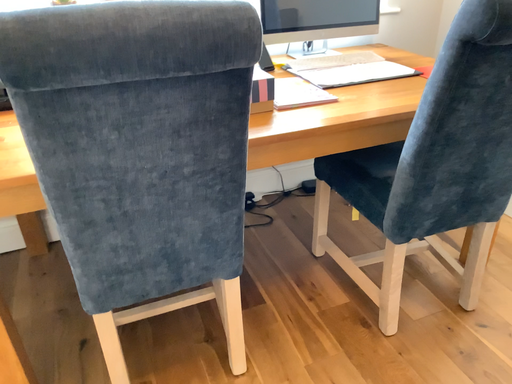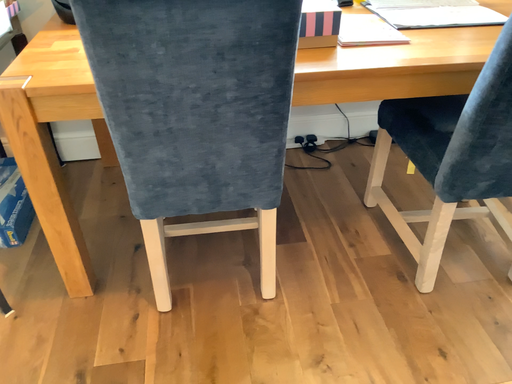
Question: How did the camera likely rotate when shooting the video?

Choices:
 (A) rotated right
 (B) rotated left

Answer: (B)